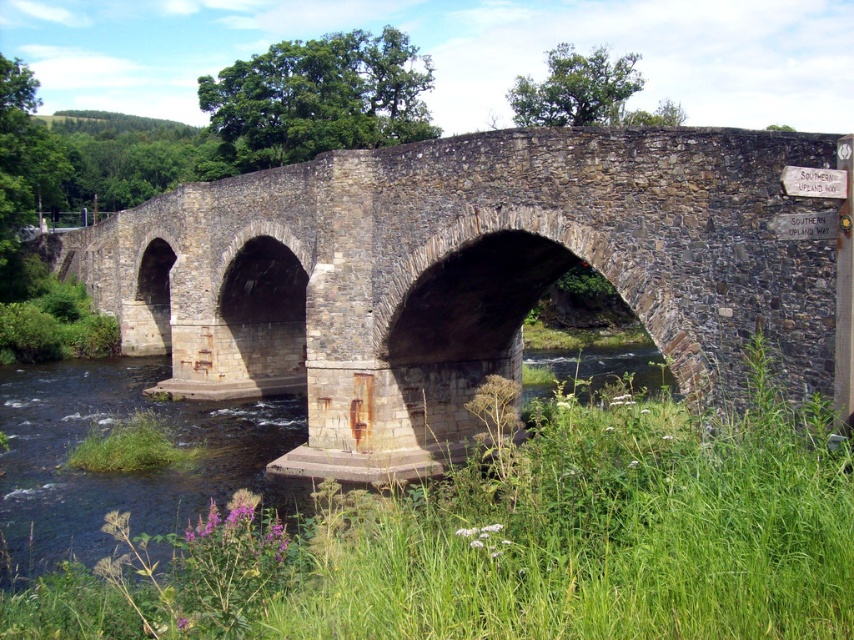
Question: Does rusty stone bridge at center come behind clear water at bridge lower?

Choices:
 (A) yes
 (B) no

Answer: (B)

Question: In this image, where is rusty stone bridge at center located relative to clear water at bridge lower?

Choices:
 (A) right
 (B) left

Answer: (B)

Question: Which of the following is the farthest from the observer?

Choices:
 (A) (291, 236)
 (B) (202, 484)

Answer: (A)

Question: Does rusty stone bridge at center have a smaller size compared to clear water at bridge lower?

Choices:
 (A) yes
 (B) no

Answer: (B)